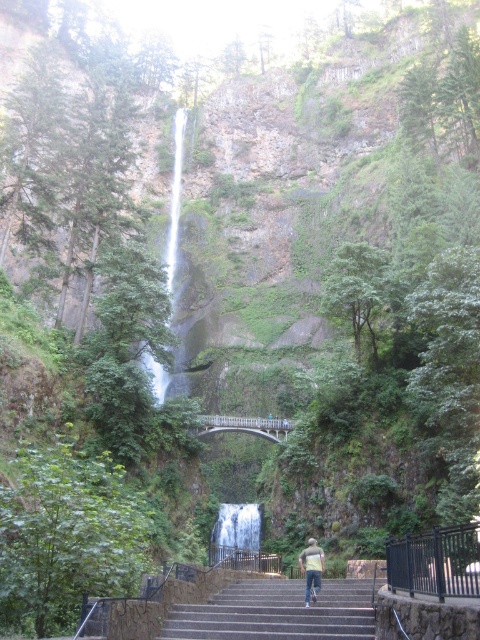
Question: Which object is closer to the camera taking this photo?

Choices:
 (A) light blue jeans at center
 (B) gray concrete stairs at center
 (C) smooth white water at center
 (D) white smooth waterfall at center

Answer: (B)

Question: Is white smooth waterfall at center smaller than light blue jeans at center?

Choices:
 (A) no
 (B) yes

Answer: (A)

Question: Among these objects, which one is farthest from the camera?

Choices:
 (A) gray concrete stairs at center
 (B) light blue jeans at center
 (C) white smooth waterfall at center
 (D) smooth white water at center

Answer: (D)

Question: Does gray concrete stairs at center appear on the left side of white smooth waterfall at center?

Choices:
 (A) yes
 (B) no

Answer: (B)

Question: Is gray concrete stairs at center bigger than smooth white water at center?

Choices:
 (A) no
 (B) yes

Answer: (A)

Question: Which of the following is the farthest from the observer?

Choices:
 (A) (177, 131)
 (B) (307, 592)
 (C) (233, 541)
 (D) (231, 586)

Answer: (A)